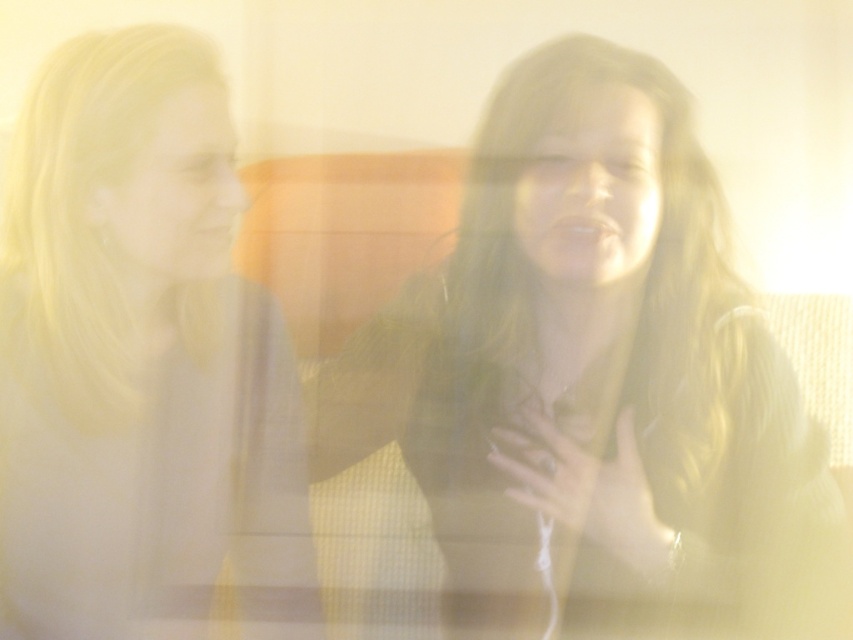
Which is more to the left, matte black shirt at center or matte white mouth at center?

matte white mouth at center is more to the left.

Can you confirm if matte black shirt at center is smaller than matte white mouth at center?

Incorrect, matte black shirt at center is not smaller in size than matte white mouth at center.

Is point (762, 502) less distant than point (233, 216)?

Yes.

Where is `matte black shirt at center`? The image size is (853, 640). matte black shirt at center is located at coordinates (593, 376).

Who is lower down, matte white shirt at left or matte white mouth at center?

matte white shirt at left is below.

Image resolution: width=853 pixels, height=640 pixels. I want to click on matte white shirt at left, so click(140, 364).

Can you confirm if matte white shirt at left is bigger than smooth white teeth at center?

Correct, matte white shirt at left is larger in size than smooth white teeth at center.

Is matte white shirt at left positioned before smooth white teeth at center?

That is False.

Is point (30, 536) in front of point (555, 221)?

That is False.

Locate an element on the screen. matte white shirt at left is located at coordinates (140, 364).